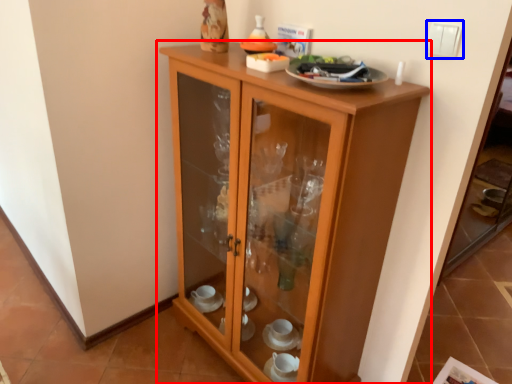
Question: Which object is further to the camera taking this photo, cupboard (highlighted by a red box) or light switch (highlighted by a blue box)?

Choices:
 (A) cupboard
 (B) light switch

Answer: (B)